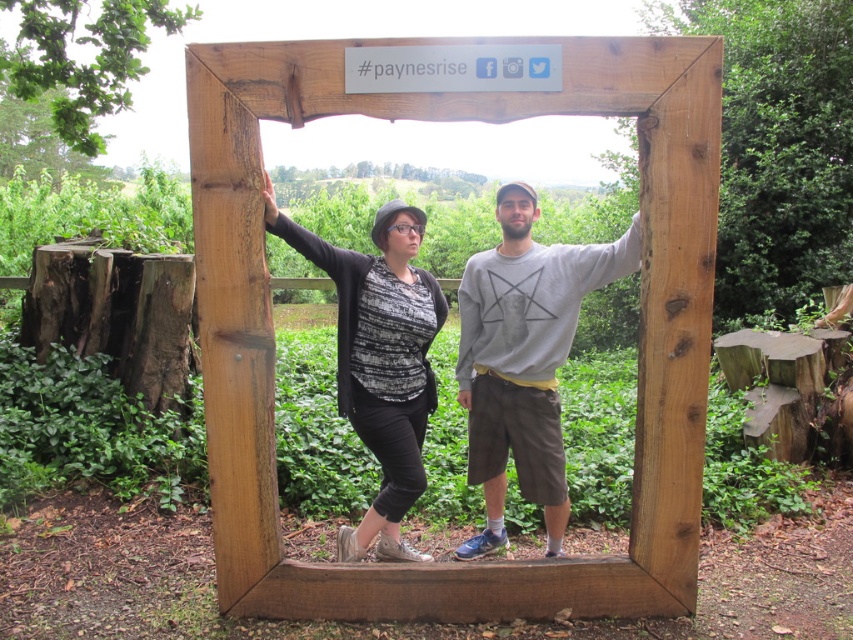
Question: Considering the real-world distances, which object is farthest from the white wood sign at upper center?

Choices:
 (A) gray cotton sweatshirt at center
 (B) matte black cardigan at left
 (C) matte gray sweater at center

Answer: (A)

Question: Does white wood sign at upper center appear on the left side of matte black cardigan at left?

Choices:
 (A) no
 (B) yes

Answer: (A)

Question: Does white wood sign at upper center come in front of matte black cardigan at left?

Choices:
 (A) yes
 (B) no

Answer: (A)

Question: Which of these objects is positioned farthest from the matte gray sweater at center?

Choices:
 (A) gray cotton sweatshirt at center
 (B) matte black cardigan at left

Answer: (B)

Question: Based on their relative distances, which object is nearer to the white wood sign at upper center?

Choices:
 (A) matte gray sweater at center
 (B) matte black cardigan at left
 (C) gray cotton sweatshirt at center

Answer: (A)

Question: Does white wood sign at upper center lie behind matte gray sweater at center?

Choices:
 (A) yes
 (B) no

Answer: (B)